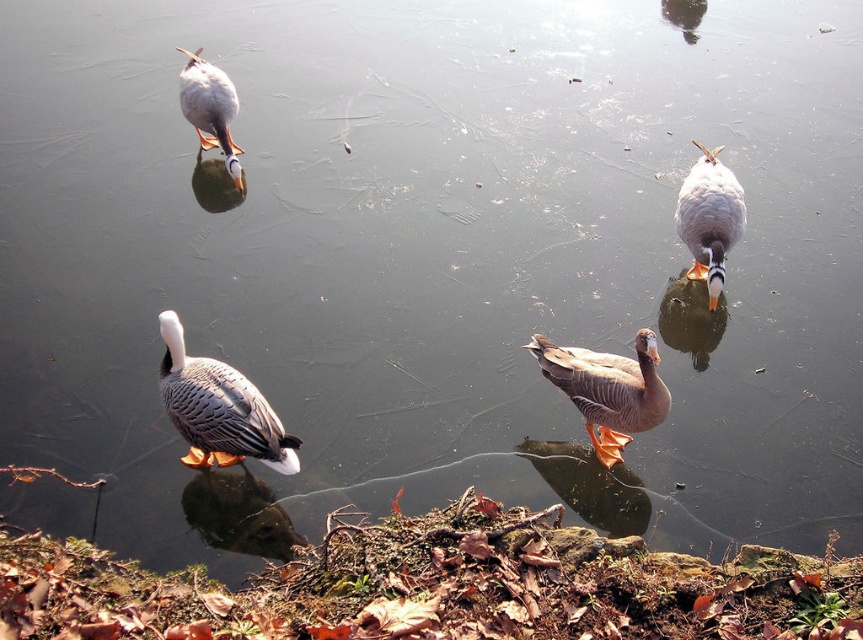
Who is higher up, gray matte duck at center or white glossy duck at upper right?

white glossy duck at upper right is above.

I want to click on gray matte duck at center, so click(608, 388).

Image resolution: width=863 pixels, height=640 pixels. I want to click on gray matte duck at center, so click(x=608, y=388).

Does white glossy duck at upper right have a greater width compared to speckled feathered duck at upper left?

No.

The width and height of the screenshot is (863, 640). I want to click on white glossy duck at upper right, so click(x=709, y=218).

Which is behind, point (712, 193) or point (199, 83)?

Point (199, 83)

Locate an element on the screen. white glossy duck at upper right is located at coordinates (709, 218).

Is speckled feathered duck at center closer to camera compared to white glossy duck at upper right?

Yes, it is in front of white glossy duck at upper right.

Who is more forward, (x=225, y=433) or (x=729, y=204)?

Point (x=225, y=433) is more forward.

The height and width of the screenshot is (640, 863). What are the coordinates of `speckled feathered duck at center` in the screenshot? It's located at click(x=218, y=410).